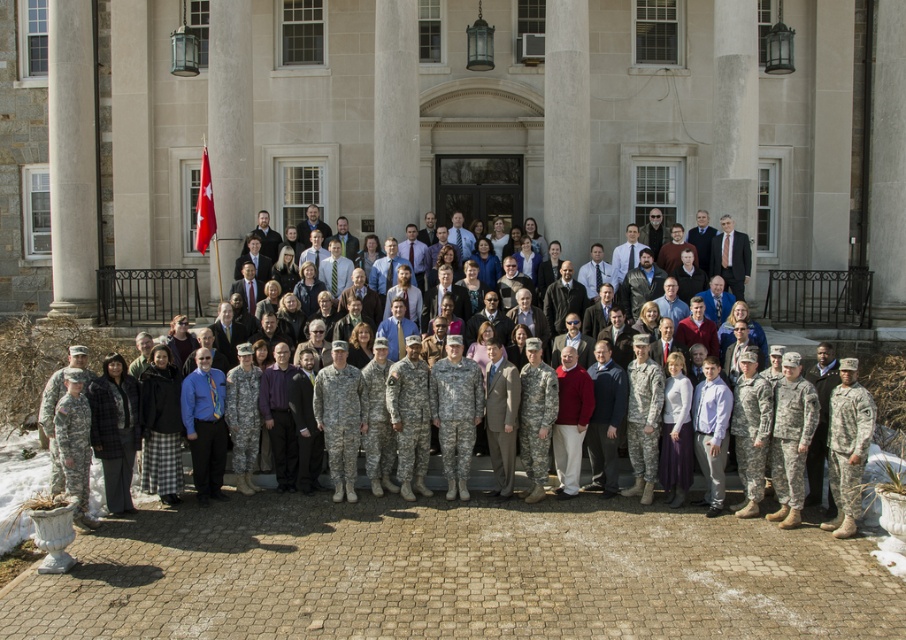
You are organizing a military fashion show and need to determine which of the two items is more suitable for a model with a larger frame. The items are the camouflage uniform at center and the camouflage fabric skirt at lower center. Which item should the model choose?

The camouflage fabric skirt at lower center is larger in size compared to the camouflage uniform at center, so the model with a larger frame should choose the camouflage fabric skirt at lower center.

Looking at this image, you are organizing a military fashion show and need to arrange two models wearing the camouflage uniform at center and the camouflage fabric skirt at lower center. Which model should you place first in the lineup to ensure the wider garment is displayed first?

The camouflage fabric skirt at lower center should be placed first in the lineup because its width is greater than the camouflage uniform at center.